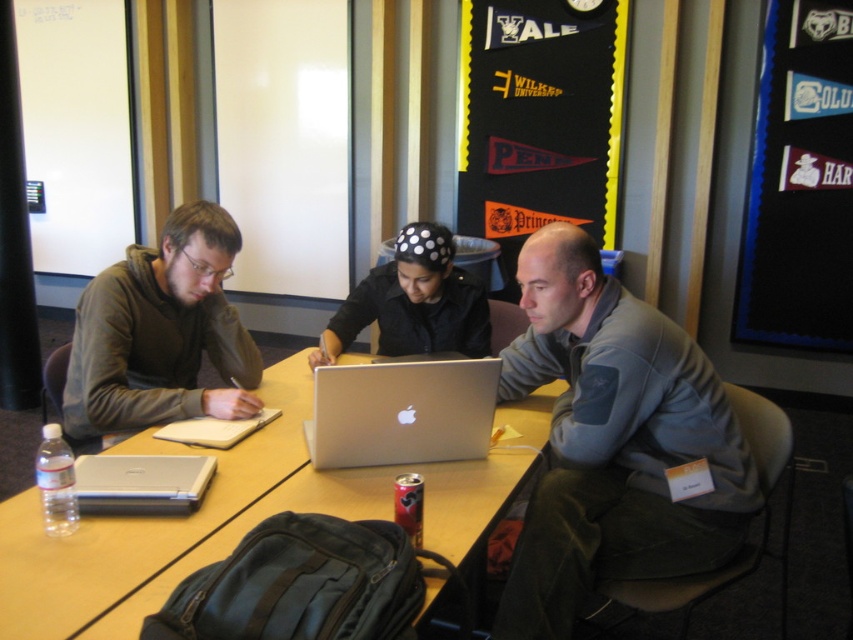
Can you confirm if matte black shirt at center is positioned to the right of silver metallic laptop at lower left?

Correct, you'll find matte black shirt at center to the right of silver metallic laptop at lower left.

From the picture: Does matte black shirt at center have a lesser width compared to silver metallic laptop at lower left?

Incorrect, matte black shirt at center's width is not less than silver metallic laptop at lower left's.

Image resolution: width=853 pixels, height=640 pixels. Describe the element at coordinates (413, 301) in the screenshot. I see `matte black shirt at center` at that location.

The width and height of the screenshot is (853, 640). I want to click on matte black shirt at center, so tap(413, 301).

Does wooden table at center have a greater width compared to metallic silver pennant at upper right?

Yes, wooden table at center is wider than metallic silver pennant at upper right.

Who is lower down, wooden table at center or metallic silver pennant at upper right?

wooden table at center

You are a GUI agent. You are given a task and a screenshot of the screen. Output one action in this format:
    pyautogui.click(x=<x>, y=<y>)
    Task: Click on the wooden table at center
    
    Given the screenshot: What is the action you would take?
    pyautogui.click(x=221, y=522)

Can you confirm if matte gray hoodie at left is thinner than matte black shirt at center?

No.

Does matte gray hoodie at left come behind matte black shirt at center?

That is False.

I want to click on matte gray hoodie at left, so click(x=161, y=332).

At what (x,y) coordinates should I click in order to perform the action: click on matte gray hoodie at left. Please return your answer as a coordinate pair (x, y). This screenshot has width=853, height=640. Looking at the image, I should click on (161, 332).